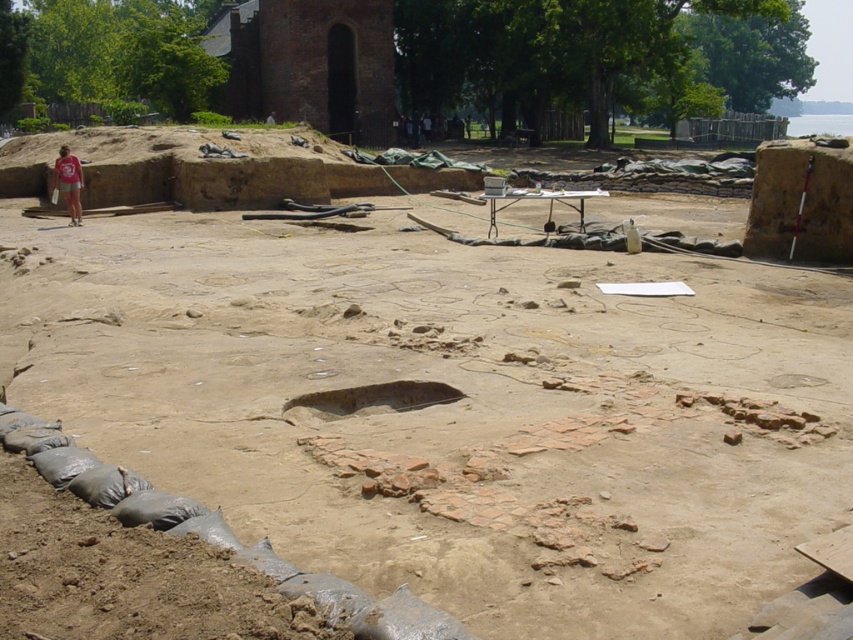
Who is higher up, brown sandy soil at center or matte pink shirt at left?

Positioned higher is matte pink shirt at left.

Is point (764, 392) less distant than point (71, 202)?

Yes, it is.

You are a GUI agent. You are given a task and a screenshot of the screen. Output one action in this format:
    pyautogui.click(x=<x>, y=<y>)
    Task: Click on the brown sandy soil at center
    This screenshot has width=853, height=640.
    Given the screenshot: What is the action you would take?
    pyautogui.click(x=451, y=408)

Image resolution: width=853 pixels, height=640 pixels. Find the location of `brown sandy soil at center`. brown sandy soil at center is located at coordinates (451, 408).